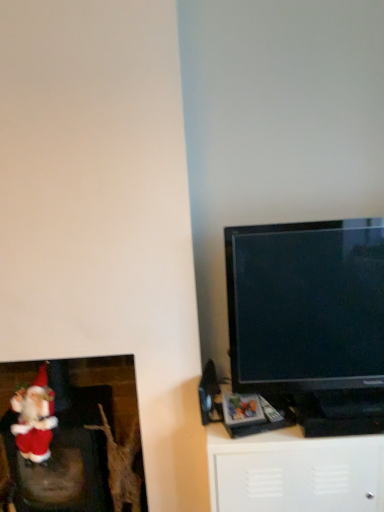
This screenshot has width=384, height=512. I want to click on red plush santa at lower left, so tap(76, 448).

The image size is (384, 512). Describe the element at coordinates (310, 319) in the screenshot. I see `black glossy tv at right` at that location.

Find the location of a particular element. white matte cabinet at lower right is located at coordinates tap(294, 472).

Is red plush santa at lower left at the left side of white matte cabinet at lower right?

Indeed, red plush santa at lower left is positioned on the left side of white matte cabinet at lower right.

From the picture: From the image's perspective, is red plush santa at lower left positioned above or below white matte cabinet at lower right?

Clearly, from the image's perspective, red plush santa at lower left is above white matte cabinet at lower right.

What's the angular difference between red plush santa at lower left and white matte cabinet at lower right's facing directions?

1.08 degrees.

Does red plush santa at lower left have a larger size compared to white matte cabinet at lower right?

No, red plush santa at lower left is not bigger than white matte cabinet at lower right.

Does white matte cabinet at lower right turn towards black glossy tv at right?

No, white matte cabinet at lower right is not oriented towards black glossy tv at right.

Which object is positioned more to the left, white matte cabinet at lower right or black glossy tv at right?

From the viewer's perspective, black glossy tv at right appears more on the left side.

Who is smaller, white matte cabinet at lower right or black glossy tv at right?

With smaller size is black glossy tv at right.

From the image's perspective, is white matte cabinet at lower right under black glossy tv at right?

Correct, white matte cabinet at lower right appears lower than black glossy tv at right in the image.

From a real-world perspective, relative to red plush santa at lower left, is black glossy tv at right vertically above or below?

black glossy tv at right is above red plush santa at lower left.

Is point (271, 296) less distant than point (108, 469)?

Yes, it is.

From the image's perspective, which is above, black glossy tv at right or red plush santa at lower left?

black glossy tv at right appears higher in the image.

Based on the photo, does black glossy tv at right lie in front of red plush santa at lower left?

Yes, black glossy tv at right is in front of red plush santa at lower left.

Based on the photo, is white matte cabinet at lower right outside of fuzzy fabric santa at lower left?

Indeed, white matte cabinet at lower right is completely outside fuzzy fabric santa at lower left.

How different are the orientations of white matte cabinet at lower right and fuzzy fabric santa at lower left in degrees?

They differ by 1.18 degrees in their facing directions.

Is white matte cabinet at lower right smaller than fuzzy fabric santa at lower left?

No, white matte cabinet at lower right is not smaller than fuzzy fabric santa at lower left.

Which is more to the right, white matte cabinet at lower right or fuzzy fabric santa at lower left?

white matte cabinet at lower right.

Is white matte cabinet at lower right inside the boundaries of red plush santa at lower left, or outside?

white matte cabinet at lower right is located beyond the bounds of red plush santa at lower left.

From the image's perspective, is white matte cabinet at lower right positioned above or below red plush santa at lower left?

Based on their image positions, white matte cabinet at lower right is located beneath red plush santa at lower left.

From a real-world perspective, relative to red plush santa at lower left, is white matte cabinet at lower right vertically above or below?

white matte cabinet at lower right is situated lower than red plush santa at lower left in the real world.

Which of these two, white matte cabinet at lower right or red plush santa at lower left, is smaller?

red plush santa at lower left is smaller.

Is fuzzy fabric santa at lower left at the left side of black glossy tv at right?

Yes, fuzzy fabric santa at lower left is to the left of black glossy tv at right.

Is fuzzy fabric santa at lower left aimed at black glossy tv at right?

No, fuzzy fabric santa at lower left is not aimed at black glossy tv at right.

Which of these two, fuzzy fabric santa at lower left or black glossy tv at right, stands taller?

With more height is black glossy tv at right.

Is fuzzy fabric santa at lower left positioned far away from black glossy tv at right?

No, fuzzy fabric santa at lower left is not far away from black glossy tv at right.

Can we say fuzzy fabric santa at lower left lies outside white matte cabinet at lower right?

fuzzy fabric santa at lower left is positioned outside white matte cabinet at lower right.

Consider the image. Is fuzzy fabric santa at lower left next to white matte cabinet at lower right and touching it?

They are not placed beside each other.

From a real-world perspective, is fuzzy fabric santa at lower left positioned above or below white matte cabinet at lower right?

From a real-world perspective, fuzzy fabric santa at lower left is physically above white matte cabinet at lower right.

Where is `furniture below the red plush santa at lower left (from the image's perspective)`? This screenshot has height=512, width=384. furniture below the red plush santa at lower left (from the image's perspective) is located at coordinates (294, 472).

I want to click on television above the white matte cabinet at lower right (from the image's perspective), so click(x=310, y=319).

Looking at the image, which one is located further to fuzzy fabric santa at lower left, black glossy tv at right or red plush santa at lower left?

black glossy tv at right lies further to fuzzy fabric santa at lower left than the other object.

Based on their spatial positions, is white matte cabinet at lower right or red plush santa at lower left further from fuzzy fabric santa at lower left?

white matte cabinet at lower right is positioned further to the anchor fuzzy fabric santa at lower left.

Consider the image. Considering their positions, is red plush santa at lower left positioned further to fuzzy fabric santa at lower left than white matte cabinet at lower right?

Among the two, white matte cabinet at lower right is located further to fuzzy fabric santa at lower left.

Estimate the real-world distances between objects in this image. Which object is closer to black glossy tv at right, fuzzy fabric santa at lower left or red plush santa at lower left?

red plush santa at lower left.

Based on their spatial positions, is fuzzy fabric santa at lower left or black glossy tv at right closer to white matte cabinet at lower right?

black glossy tv at right lies closer to white matte cabinet at lower right than the other object.

Estimate the real-world distances between objects in this image. Which object is further from white matte cabinet at lower right, black glossy tv at right or red plush santa at lower left?

Based on the image, red plush santa at lower left appears to be further to white matte cabinet at lower right.

Considering their positions, is white matte cabinet at lower right positioned closer to black glossy tv at right than red plush santa at lower left?

The object closer to black glossy tv at right is white matte cabinet at lower right.

Looking at the image, which one is located closer to red plush santa at lower left, fuzzy fabric santa at lower left or black glossy tv at right?

fuzzy fabric santa at lower left is positioned closer to the anchor red plush santa at lower left.

The height and width of the screenshot is (512, 384). I want to click on fireplace located between fuzzy fabric santa at lower left and black glossy tv at right in the left-right direction, so click(x=76, y=448).

You are a GUI agent. You are given a task and a screenshot of the screen. Output one action in this format:
    pyautogui.click(x=<x>, y=<y>)
    Task: Click on the television between red plush santa at lower left and white matte cabinet at lower right in the horizontal direction
    
    Given the screenshot: What is the action you would take?
    pyautogui.click(x=310, y=319)

You are a GUI agent. You are given a task and a screenshot of the screen. Output one action in this format:
    pyautogui.click(x=<x>, y=<y>)
    Task: Click on the fireplace between fuzzy fabric santa at lower left and white matte cabinet at lower right from left to right
    This screenshot has height=512, width=384.
    Given the screenshot: What is the action you would take?
    pyautogui.click(x=76, y=448)

Identify the location of television between fuzzy fabric santa at lower left and white matte cabinet at lower right. This screenshot has width=384, height=512. (310, 319).